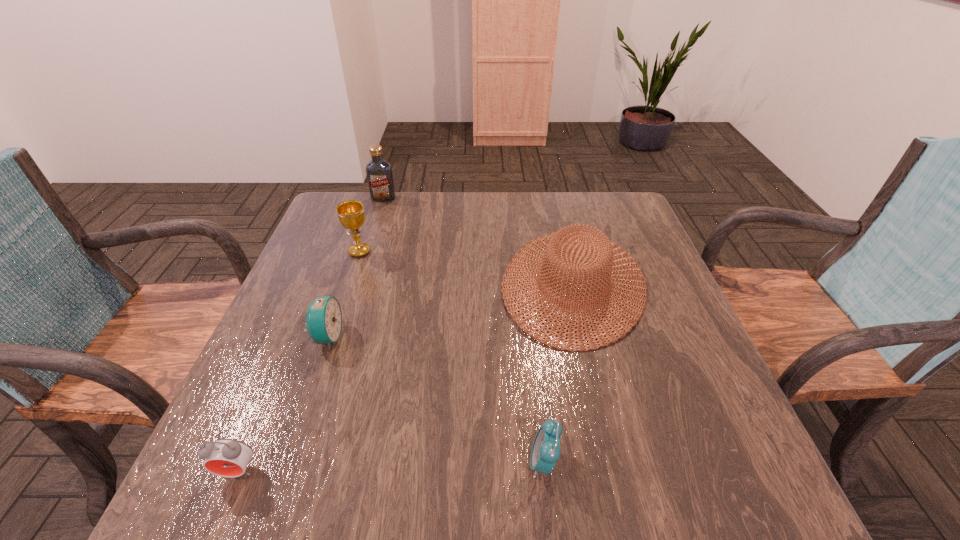
Where is `unoccupied position between the rightmost alarm clock and the second alarm clock from right to left`? Image resolution: width=960 pixels, height=540 pixels. unoccupied position between the rightmost alarm clock and the second alarm clock from right to left is located at coordinates [436, 400].

At what (x,y) coordinates should I click in order to perform the action: click on free space between the second alarm clock from right to left and the sunhat. Please return your answer as a coordinate pair (x, y). This screenshot has width=960, height=540. Looking at the image, I should click on (450, 310).

Locate an element on the screen. The width and height of the screenshot is (960, 540). free space between the second tallest object and the tallest object is located at coordinates (372, 225).

You are a GUI agent. You are given a task and a screenshot of the screen. Output one action in this format:
    pyautogui.click(x=<x>, y=<y>)
    Task: Click on the vacant area that lies between the second alarm clock from left to right and the chalice
    The height and width of the screenshot is (540, 960).
    Given the screenshot: What is the action you would take?
    pyautogui.click(x=344, y=294)

You are a GUI agent. You are given a task and a screenshot of the screen. Output one action in this format:
    pyautogui.click(x=<x>, y=<y>)
    Task: Click on the free space between the rightmost alarm clock and the sunhat
    Image resolution: width=960 pixels, height=540 pixels.
    Given the screenshot: What is the action you would take?
    pyautogui.click(x=559, y=373)

I want to click on empty space that is in between the tallest object and the sunhat, so click(478, 241).

The height and width of the screenshot is (540, 960). I want to click on the second closest object to the leftmost alarm clock, so click(545, 452).

Identify which object is the second closest to the sunhat. Please provide its 2D coordinates. Your answer should be formatted as a tuple, i.e. [(x, y)], where the tuple contains the x and y coordinates of a point satisfying the conditions above.

[(351, 214)]

Where is `alarm clock that can be found as the third closest to the vodka`? This screenshot has height=540, width=960. alarm clock that can be found as the third closest to the vodka is located at coordinates (545, 452).

Identify which alarm clock is the second closest to the leftmost alarm clock. Please provide its 2D coordinates. Your answer should be formatted as a tuple, i.e. [(x, y)], where the tuple contains the x and y coordinates of a point satisfying the conditions above.

[(545, 452)]